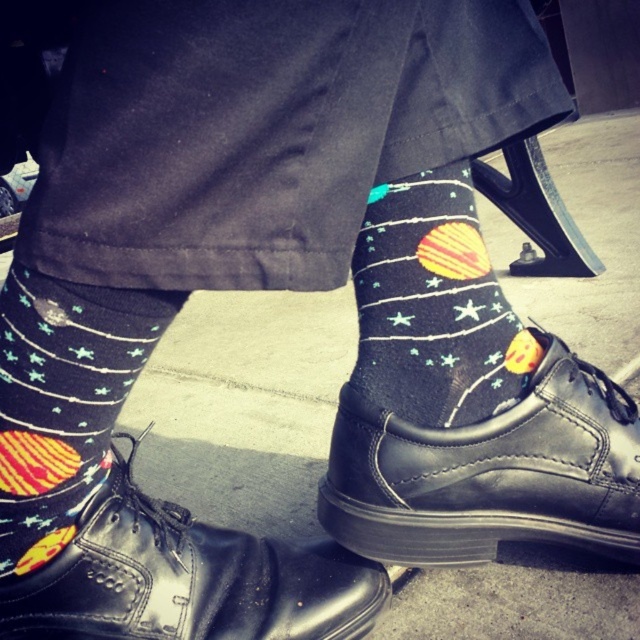
You are trying to put on the black leather shoe at center. The shoe is currently placed next to the matte black socks with space design at lower left. Based on their widths, will the shoe fit over the socks?

The black leather shoe at center might be wider than matte black socks with space design at lower left, so it is possible that the shoe will fit over the socks.